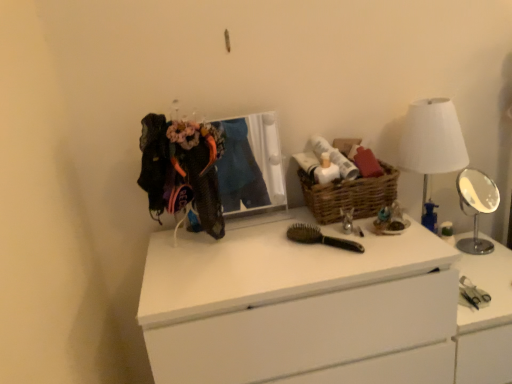
Question: From a real-world perspective, is black wooden hairbrush at center positioned under silver metallic mirror at right based on gravity?

Choices:
 (A) yes
 (B) no

Answer: (B)

Question: Is black wooden hairbrush at center wider than silver metallic mirror at right?

Choices:
 (A) no
 (B) yes

Answer: (B)

Question: Can you confirm if black wooden hairbrush at center is bigger than silver metallic mirror at right?

Choices:
 (A) yes
 (B) no

Answer: (B)

Question: Is black wooden hairbrush at center shorter than silver metallic mirror at right?

Choices:
 (A) no
 (B) yes

Answer: (B)

Question: From the image's perspective, is black wooden hairbrush at center on top of silver metallic mirror at right?

Choices:
 (A) no
 (B) yes

Answer: (A)

Question: Would you consider black wooden hairbrush at center to be distant from silver metallic mirror at right?

Choices:
 (A) yes
 (B) no

Answer: (B)

Question: From a real-world perspective, is white fabric lampshade at right over woven brown basket at center?

Choices:
 (A) yes
 (B) no

Answer: (B)

Question: Can you confirm if white fabric lampshade at right is thinner than woven brown basket at center?

Choices:
 (A) yes
 (B) no

Answer: (B)

Question: Is white fabric lampshade at right next to woven brown basket at center and touching it?

Choices:
 (A) no
 (B) yes

Answer: (A)

Question: From a real-world perspective, does white fabric lampshade at right sit lower than woven brown basket at center?

Choices:
 (A) no
 (B) yes

Answer: (B)

Question: Can you confirm if white fabric lampshade at right is positioned to the left of woven brown basket at center?

Choices:
 (A) no
 (B) yes

Answer: (A)

Question: Is woven brown basket at center completely or partially inside white fabric lampshade at right?

Choices:
 (A) no
 (B) yes

Answer: (A)

Question: Does white plastic vanity at right lie behind white fabric lampshade at right?

Choices:
 (A) yes
 (B) no

Answer: (B)